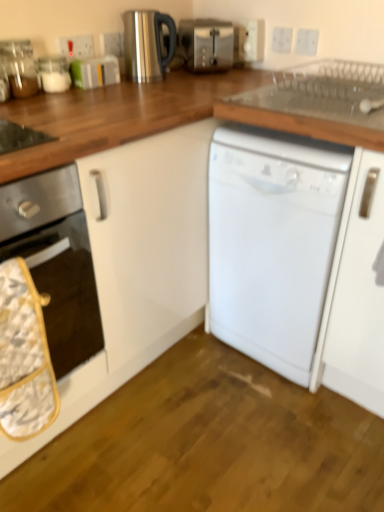
Question: From the image's perspective, is white plastic electric outlet at upper center, the second electric outlet in the left-to-right sequence, under clear glass jar at upper left, the 1th appliance in the left-to-right sequence?

Choices:
 (A) no
 (B) yes

Answer: (A)

Question: Is white plastic electric outlet at upper center, which is counted as the 4th electric outlet, starting from the right, aimed at clear glass jar at upper left, the third appliance viewed from the right?

Choices:
 (A) no
 (B) yes

Answer: (A)

Question: Does white plastic electric outlet at upper center, which is counted as the 4th electric outlet, starting from the right, have a greater width compared to clear glass jar at upper left, the third appliance viewed from the right?

Choices:
 (A) no
 (B) yes

Answer: (A)

Question: Considering the relative sizes of white plastic electric outlet at upper center, the second electric outlet in the left-to-right sequence, and clear glass jar at upper left, the third appliance viewed from the right, in the image provided, is white plastic electric outlet at upper center, the second electric outlet in the left-to-right sequence, shorter than clear glass jar at upper left, the third appliance viewed from the right,?

Choices:
 (A) yes
 (B) no

Answer: (A)

Question: Which is correct: white plastic electric outlet at upper center, which is the fifth electric outlet from right to left, is inside stainless steel kettle at upper center, positioned as the first appliance in right-to-left order, or outside of it?

Choices:
 (A) inside
 (B) outside

Answer: (B)

Question: Looking at the image, does white plastic electric outlet at upper center, which appears as the first electric outlet when viewed from the left, seem bigger or smaller compared to stainless steel kettle at upper center, the 3th appliance in the left-to-right sequence?

Choices:
 (A) big
 (B) small

Answer: (B)

Question: Considering the relative positions of white plastic electric outlet at upper center, which appears as the first electric outlet when viewed from the left, and stainless steel kettle at upper center, the 3th appliance in the left-to-right sequence, in the image provided, is white plastic electric outlet at upper center, which appears as the first electric outlet when viewed from the left, to the left or to the right of stainless steel kettle at upper center, the 3th appliance in the left-to-right sequence,?

Choices:
 (A) left
 (B) right

Answer: (A)

Question: Relative to stainless steel kettle at upper center, the 3th appliance in the left-to-right sequence, is white plastic electric outlet at upper center, which appears as the first electric outlet when viewed from the left, in front or behind?

Choices:
 (A) front
 (B) behind

Answer: (B)

Question: Considering the positions of white plastic electric outlet at upper center, which appears as the 1th electric outlet when viewed from the right, and white plastic electric outlet at upper center, the 3th electric outlet from the right, in the image, is white plastic electric outlet at upper center, which appears as the 1th electric outlet when viewed from the right, bigger or smaller than white plastic electric outlet at upper center, the 3th electric outlet from the right,?

Choices:
 (A) big
 (B) small

Answer: (B)

Question: Visually, is white plastic electric outlet at upper center, which appears as the 1th electric outlet when viewed from the right, positioned to the left or to the right of white plastic electric outlet at upper center, arranged as the third electric outlet when viewed from the left?

Choices:
 (A) right
 (B) left

Answer: (A)

Question: Considering the positions of white plastic electric outlet at upper center, which appears as the 1th electric outlet when viewed from the right, and white plastic electric outlet at upper center, the 3th electric outlet from the right, in the image, is white plastic electric outlet at upper center, which appears as the 1th electric outlet when viewed from the right, wider or thinner than white plastic electric outlet at upper center, the 3th electric outlet from the right,?

Choices:
 (A) thin
 (B) wide

Answer: (A)

Question: From a real-world perspective, is white plastic electric outlet at upper center, which appears as the 1th electric outlet when viewed from the right, positioned above or below white plastic electric outlet at upper center, arranged as the third electric outlet when viewed from the left?

Choices:
 (A) above
 (B) below

Answer: (A)

Question: From a real-world perspective, is white glossy oven at left positioned above or below stainless steel kettle at upper center, the 3th appliance in the left-to-right sequence?

Choices:
 (A) below
 (B) above

Answer: (A)

Question: Considering the positions of white glossy oven at left and stainless steel kettle at upper center, the 3th appliance in the left-to-right sequence, in the image, is white glossy oven at left taller or shorter than stainless steel kettle at upper center, the 3th appliance in the left-to-right sequence,?

Choices:
 (A) short
 (B) tall

Answer: (B)